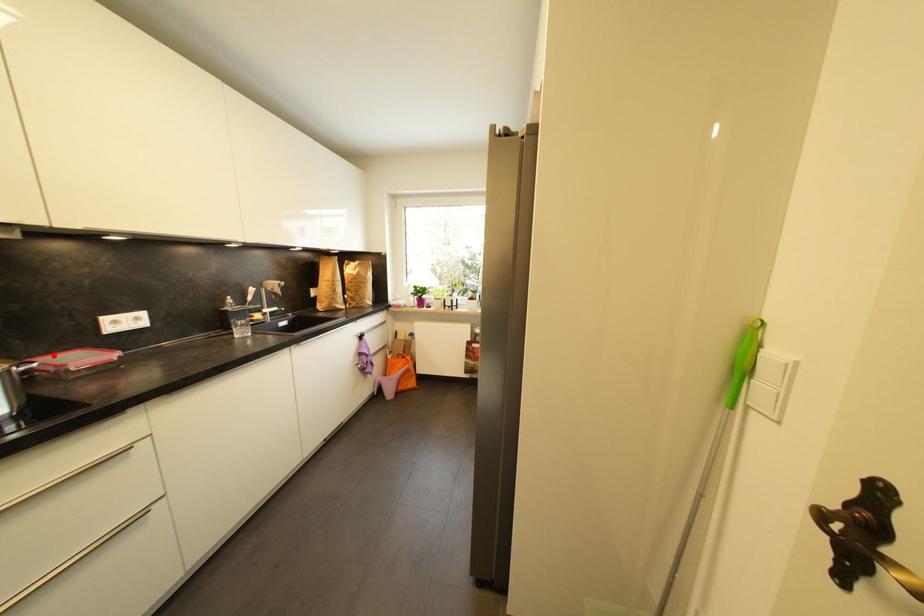
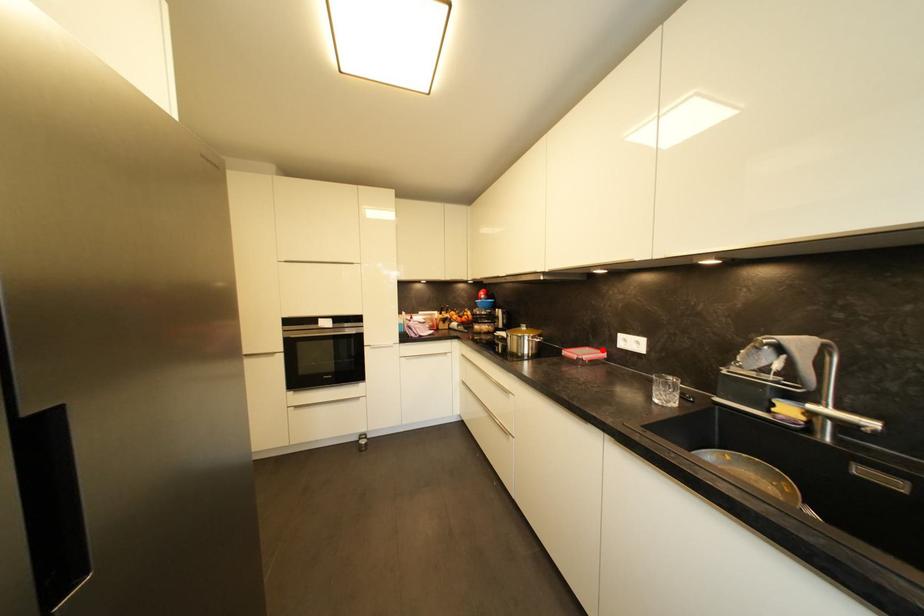
I am providing you with two images of the same scene from different viewpoints. A red point is marked on the first image and another point is marked on the second image. Is the marked point in image1 the same physical position as the marked point in image2?

Yes